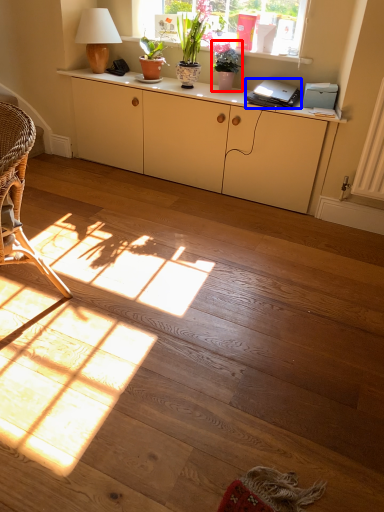
Question: Which object appears farthest to the camera in this image, houseplant (highlighted by a red box) or laptop (highlighted by a blue box)?

Choices:
 (A) houseplant
 (B) laptop

Answer: (A)